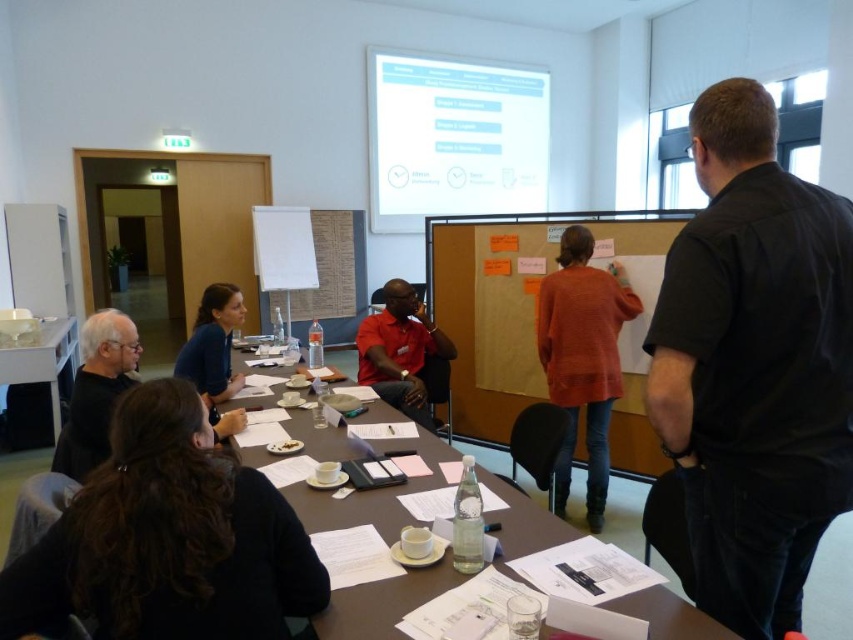
Image resolution: width=853 pixels, height=640 pixels. Describe the element at coordinates (506, 307) in the screenshot. I see `orange fabric bulletin board at center` at that location.

Does orange fabric bulletin board at center come in front of matte red shirt at center?

No, orange fabric bulletin board at center is behind matte red shirt at center.

This screenshot has width=853, height=640. Describe the element at coordinates (506, 307) in the screenshot. I see `orange fabric bulletin board at center` at that location.

I want to click on orange fabric bulletin board at center, so click(x=506, y=307).

What do you see at coordinates (753, 365) in the screenshot?
I see `black shirt at right` at bounding box center [753, 365].

Between point (688, 278) and point (637, 310), which one is positioned in front?

Point (688, 278) is in front.

Who is more distant from viewer, (730, 573) or (593, 460)?

Point (593, 460)

Identify the location of black shirt at right. [x=753, y=365].

Looking at this image, between dark brown hair at lower left and white glossy projection screen at upper center, which one appears on the right side from the viewer's perspective?

white glossy projection screen at upper center

Does point (305, 602) lie in front of point (395, 227)?

Yes.

Does point (13, 618) come closer to viewer compared to point (405, 113)?

Yes, it is in front of point (405, 113).

Find the location of a particular element. dark brown hair at lower left is located at coordinates (167, 538).